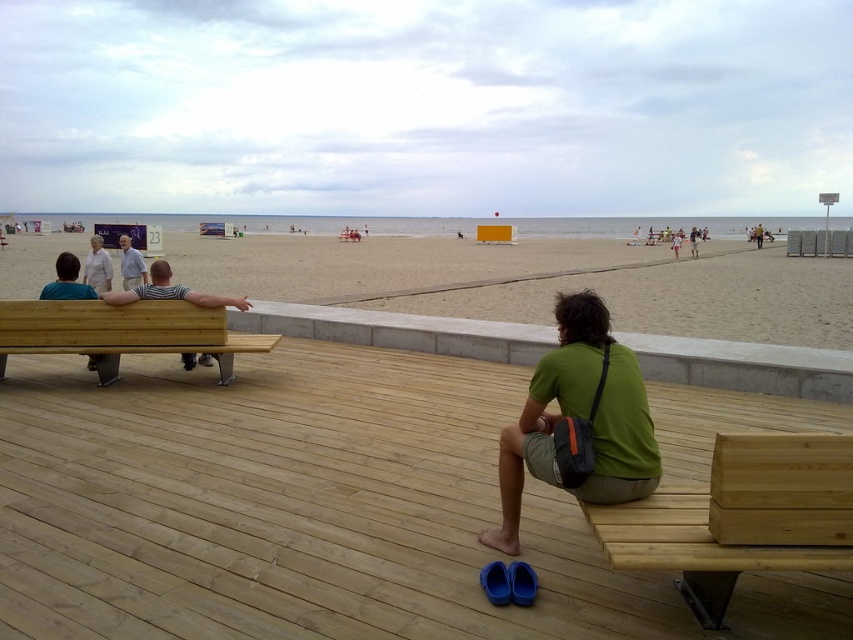
Is beige sand at center to the left of gray fabric shirt at left from the viewer's perspective?

No, beige sand at center is not to the left of gray fabric shirt at left.

Which is behind, point (821, 316) or point (123, 260)?

The point (821, 316) is more distant.

What are the coordinates of `beige sand at center` in the screenshot? It's located at (538, 282).

Does beige sand at center appear over white cotton shirt at left?

Correct, beige sand at center is located above white cotton shirt at left.

Who is positioned more to the left, beige sand at center or white cotton shirt at left?

white cotton shirt at left

Does point (296, 243) come closer to viewer compared to point (82, 276)?

No, (296, 243) is further to viewer.

Identify the location of beige sand at center. tap(538, 282).

Measure the distance between natural wood bench at lower right and gray fabric shirt at left.

natural wood bench at lower right and gray fabric shirt at left are 5.67 meters apart.

Which of these two, natural wood bench at lower right or gray fabric shirt at left, stands taller?

gray fabric shirt at left is taller.

Which is in front, point (769, 532) or point (142, 262)?

Point (769, 532)

In order to click on natural wood bench at lower right in this screenshot , I will do `click(740, 516)`.